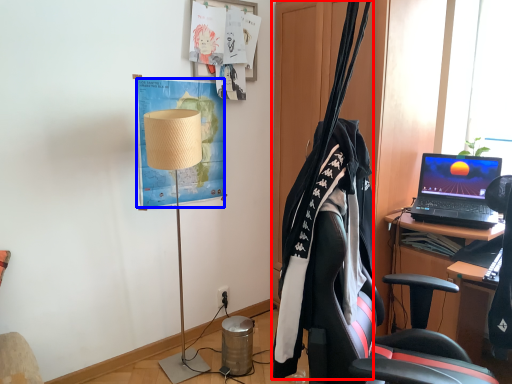
Question: Which object is closer to the camera taking this photo, clothesline (highlighted by a red box) or poster (highlighted by a blue box)?

Choices:
 (A) clothesline
 (B) poster

Answer: (A)